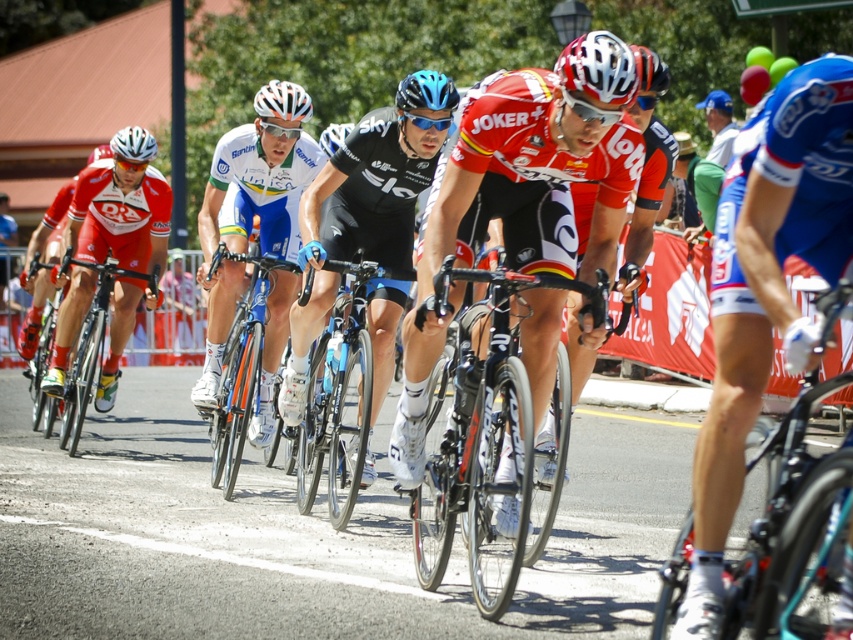
You are a photographer positioned at the starting line of the race. You want to capture a photo of both the orange metallic bicycle at center and the white matte bicycle helmet at center in the same frame. Which object should you focus on first to ensure both are in clear focus?

The orange metallic bicycle at center is further to the viewer than the white matte bicycle helmet at center. To ensure both are in clear focus, you should focus on the orange metallic bicycle at center first, as it is closer to you, and the helmet will be in the background. Adjusting focus to the closer object allows the background object to remain sharp within the depth of field.